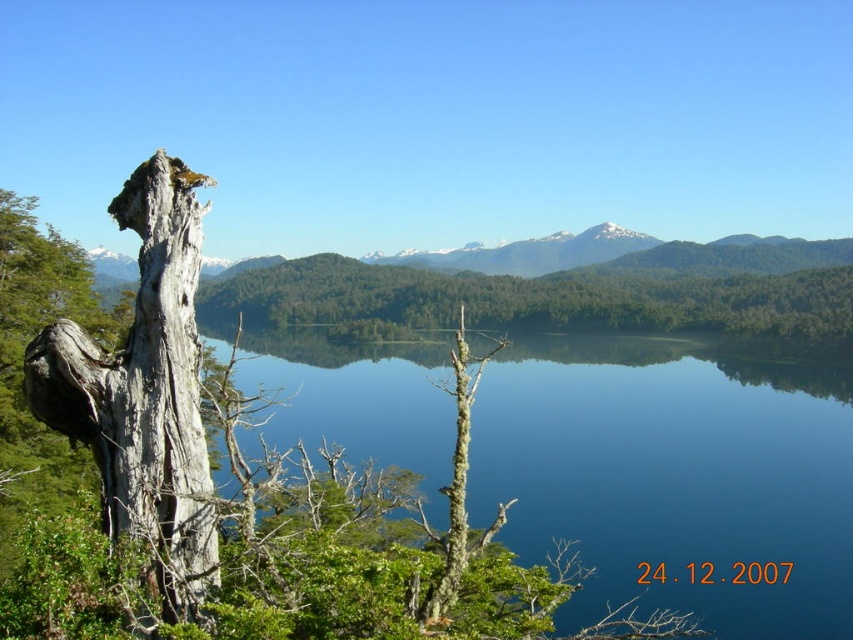
Question: Which object is positioned farthest from the gray rough bark tree trunk at left?

Choices:
 (A) gray rough bark tree at left
 (B) blue glassy water at center

Answer: (B)

Question: Can you confirm if gray rough bark tree at left is positioned above blue glassy water at center?

Choices:
 (A) no
 (B) yes

Answer: (B)

Question: Considering the real-world distances, which object is farthest from the gray rough bark tree trunk at left?

Choices:
 (A) gray rough bark tree at left
 (B) blue glassy water at center

Answer: (B)

Question: Observing the image, what is the correct spatial positioning of blue glassy water at center in reference to gray rough bark tree trunk at left?

Choices:
 (A) below
 (B) above

Answer: (A)

Question: Which object appears closest to the camera in this image?

Choices:
 (A) gray rough bark tree trunk at left
 (B) gray rough bark tree at left

Answer: (B)

Question: Can you confirm if blue glassy water at center is positioned to the left of gray rough bark tree trunk at left?

Choices:
 (A) no
 (B) yes

Answer: (A)